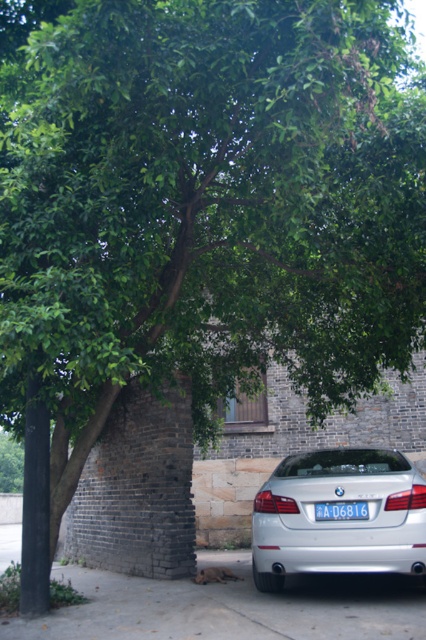
How far apart are gray concrete pavement at lower center and silver metallic sedan at lower center?

They are 3.29 feet apart.

Does gray concrete pavement at lower center appear over silver metallic sedan at lower center?

No, gray concrete pavement at lower center is not above silver metallic sedan at lower center.

Is point (308, 636) positioned before point (359, 524)?

Yes, it is.

This screenshot has width=426, height=640. What are the coordinates of `gray concrete pavement at lower center` in the screenshot? It's located at (230, 608).

Is gray concrete pavement at lower center closer to the viewer compared to blue metallic license plate at center?

Yes, it is in front of blue metallic license plate at center.

Can you confirm if gray concrete pavement at lower center is smaller than blue metallic license plate at center?

No.

Where is `gray concrete pavement at lower center`? Image resolution: width=426 pixels, height=640 pixels. gray concrete pavement at lower center is located at coordinates (230, 608).

Between silver metallic sedan at lower center and blue metallic license plate at center, which one has less height?

With less height is blue metallic license plate at center.

Does point (331, 563) lie in front of point (360, 513)?

Yes, it is.

Between point (301, 545) and point (319, 502), which one is positioned behind?

The point (319, 502) is behind.

I want to click on silver metallic sedan at lower center, so click(339, 520).